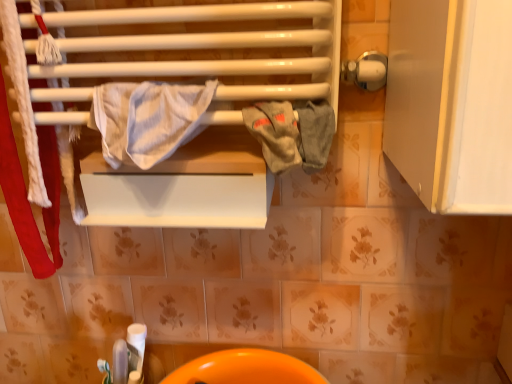
Question: In which direction should I rotate to look at gray cotton towel at center, which is the 1th bath towel from right to left?

Choices:
 (A) right
 (B) left

Answer: (A)

Question: Should I look upward or downward to see white striped fabric at center, which is the first bath towel from left to right?

Choices:
 (A) up
 (B) down

Answer: (A)

Question: From the image's perspective, is orange glossy sink at lower center located above gray cotton towel at center, which is the 1th bath towel from right to left?

Choices:
 (A) yes
 (B) no

Answer: (B)

Question: Considering the relative sizes of orange glossy sink at lower center and gray cotton towel at center, which is the 1th bath towel from right to left, in the image provided, is orange glossy sink at lower center bigger than gray cotton towel at center, which is the 1th bath towel from right to left,?

Choices:
 (A) yes
 (B) no

Answer: (A)

Question: Is the depth of orange glossy sink at lower center less than that of gray cotton towel at center, which is the 1th bath towel from right to left?

Choices:
 (A) yes
 (B) no

Answer: (B)

Question: Does orange glossy sink at lower center have a lesser width compared to gray cotton towel at center, the second bath towel when ordered from left to right?

Choices:
 (A) no
 (B) yes

Answer: (A)

Question: Can you confirm if orange glossy sink at lower center is positioned to the right of gray cotton towel at center, the second bath towel when ordered from left to right?

Choices:
 (A) yes
 (B) no

Answer: (B)

Question: Is orange glossy sink at lower center outside gray cotton towel at center, which is the 1th bath towel from right to left?

Choices:
 (A) no
 (B) yes

Answer: (B)

Question: From a real-world perspective, is white striped fabric at center, which is the first bath towel from left to right, positioned under gray cotton towel at center, the second bath towel when ordered from left to right, based on gravity?

Choices:
 (A) no
 (B) yes

Answer: (A)

Question: Is white striped fabric at center, which is the first bath towel from left to right, far away from gray cotton towel at center, the second bath towel when ordered from left to right?

Choices:
 (A) yes
 (B) no

Answer: (B)

Question: Does white striped fabric at center, which is the first bath towel from left to right, have a larger size compared to gray cotton towel at center, the second bath towel when ordered from left to right?

Choices:
 (A) yes
 (B) no

Answer: (A)

Question: Is white striped fabric at center, which appears as the 2th bath towel when viewed from the right, facing away from gray cotton towel at center, the second bath towel when ordered from left to right?

Choices:
 (A) no
 (B) yes

Answer: (A)

Question: From the image's perspective, is white striped fabric at center, which is the first bath towel from left to right, on top of gray cotton towel at center, which is the 1th bath towel from right to left?

Choices:
 (A) yes
 (B) no

Answer: (A)

Question: Considering the relative sizes of white striped fabric at center, which is the first bath towel from left to right, and gray cotton towel at center, which is the 1th bath towel from right to left, in the image provided, is white striped fabric at center, which is the first bath towel from left to right, smaller than gray cotton towel at center, which is the 1th bath towel from right to left,?

Choices:
 (A) no
 (B) yes

Answer: (A)

Question: Does gray cotton towel at center, the second bath towel when ordered from left to right, have a lesser width compared to orange glossy sink at lower center?

Choices:
 (A) yes
 (B) no

Answer: (A)